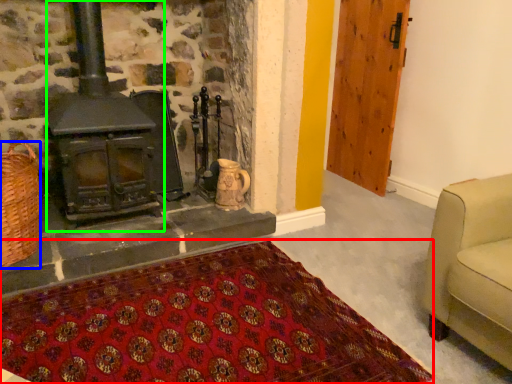
Question: Based on their relative distances, which object is farther from mat (highlighted by a red box)? Choose from basket (highlighted by a blue box) and wood burning stove (highlighted by a green box).

Choices:
 (A) basket
 (B) wood burning stove

Answer: (B)